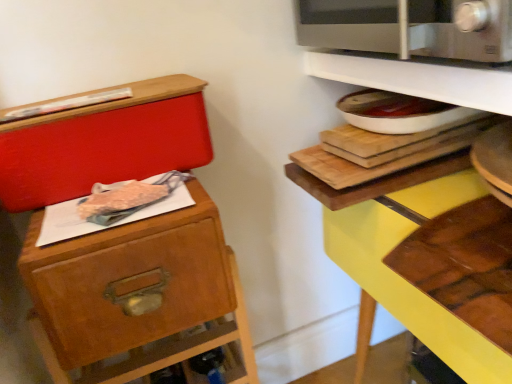
The image size is (512, 384). What are the coordinates of `matte red box at upper left` in the screenshot? It's located at (104, 143).

The height and width of the screenshot is (384, 512). Describe the element at coordinates (133, 292) in the screenshot. I see `wooden drawer at left` at that location.

What is the approximate width of wooden drawer at left?

wooden drawer at left is 7.72 inches wide.

This screenshot has width=512, height=384. What do you see at coordinates (418, 77) in the screenshot?
I see `yellow wood shelf at upper right, which ranks as the 2th shelf in top-to-bottom order` at bounding box center [418, 77].

What do you see at coordinates (461, 29) in the screenshot? This screenshot has height=384, width=512. I see `satin silver microwave at upper right` at bounding box center [461, 29].

Locate an element on the screen. white glossy shelf at upper right, the 2th shelf when ordered from bottom to top is located at coordinates (419, 77).

Considering the sizes of objects matte red box at upper left and wooden drawer at left in the image provided, who is wider, matte red box at upper left or wooden drawer at left?

matte red box at upper left is wider.

Which is less distant, [178,94] or [124,251]?

Point [178,94] is farther from the camera than point [124,251].

From the image's perspective, is matte red box at upper left located beneath wooden drawer at left?

Actually, matte red box at upper left appears above wooden drawer at left in the image.

Is matte red box at upper left bigger or smaller than wooden drawer at left?

matte red box at upper left is bigger than wooden drawer at left.

Is point (480, 54) positioned behind point (382, 185)?

No.

Could you tell me if satin silver microwave at upper right is turned towards yellow wood shelf at upper right, which appears as the 1th shelf when ordered from the bottom?

No, satin silver microwave at upper right is not oriented towards yellow wood shelf at upper right, which appears as the 1th shelf when ordered from the bottom.

What's the angular difference between satin silver microwave at upper right and yellow wood shelf at upper right, which ranks as the 2th shelf in top-to-bottom order,'s facing directions?

There is a 0.464-degree angle between the facing directions of satin silver microwave at upper right and yellow wood shelf at upper right, which ranks as the 2th shelf in top-to-bottom order.

Does satin silver microwave at upper right have a lesser width compared to yellow wood shelf at upper right, which ranks as the 2th shelf in top-to-bottom order?

Yes, satin silver microwave at upper right is thinner than yellow wood shelf at upper right, which ranks as the 2th shelf in top-to-bottom order.

Who is smaller, matte red box at upper left or satin silver microwave at upper right?

With smaller size is matte red box at upper left.

From a real-world perspective, relative to satin silver microwave at upper right, is matte red box at upper left vertically above or below?

Clearly, from a real-world perspective, matte red box at upper left is below satin silver microwave at upper right.

Does point (138, 87) come farther from viewer compared to point (297, 8)?

That is False.

Considering the sizes of objects matte red box at upper left and satin silver microwave at upper right in the image provided, who is taller, matte red box at upper left or satin silver microwave at upper right?

With more height is matte red box at upper left.

From the image's perspective, does wooden drawer at left appear lower than white glossy shelf at upper right, positioned as the first shelf in top-to-bottom order?

Correct, wooden drawer at left appears lower than white glossy shelf at upper right, positioned as the first shelf in top-to-bottom order, in the image.

Find the location of `the 1st shelf in front of the wooden drawer at left`. the 1st shelf in front of the wooden drawer at left is located at coordinates (419, 77).

Looking at this image, can you confirm if wooden drawer at left is wider than white glossy shelf at upper right, positioned as the first shelf in top-to-bottom order?

Incorrect, the width of wooden drawer at left does not surpass that of white glossy shelf at upper right, positioned as the first shelf in top-to-bottom order.

Is wooden drawer at left aimed at white glossy shelf at upper right, the 2th shelf when ordered from bottom to top?

No, wooden drawer at left is not aimed at white glossy shelf at upper right, the 2th shelf when ordered from bottom to top.

Between yellow wood shelf at upper right, which ranks as the 2th shelf in top-to-bottom order, and white glossy shelf at upper right, the 2th shelf when ordered from bottom to top, which one has larger width?

With larger width is yellow wood shelf at upper right, which ranks as the 2th shelf in top-to-bottom order.

Is yellow wood shelf at upper right, which ranks as the 2th shelf in top-to-bottom order, facing towards white glossy shelf at upper right, the 2th shelf when ordered from bottom to top?

No, yellow wood shelf at upper right, which ranks as the 2th shelf in top-to-bottom order, is not facing towards white glossy shelf at upper right, the 2th shelf when ordered from bottom to top.

How many degrees apart are the facing directions of yellow wood shelf at upper right, which ranks as the 2th shelf in top-to-bottom order, and white glossy shelf at upper right, the 2th shelf when ordered from bottom to top?

The angle between the facing direction of yellow wood shelf at upper right, which ranks as the 2th shelf in top-to-bottom order, and the facing direction of white glossy shelf at upper right, the 2th shelf when ordered from bottom to top, is 0.374 degrees.

Which point is more distant from viewer, (403, 320) or (371, 81)?

Point (403, 320)

From the image's perspective, relative to satin silver microwave at upper right, is white glossy shelf at upper right, the 2th shelf when ordered from bottom to top, above or below?

white glossy shelf at upper right, the 2th shelf when ordered from bottom to top, is situated lower than satin silver microwave at upper right in the image.

Can you confirm if white glossy shelf at upper right, positioned as the first shelf in top-to-bottom order, is bigger than satin silver microwave at upper right?

No, white glossy shelf at upper right, positioned as the first shelf in top-to-bottom order, is not bigger than satin silver microwave at upper right.

Who is shorter, white glossy shelf at upper right, positioned as the first shelf in top-to-bottom order, or satin silver microwave at upper right?

white glossy shelf at upper right, positioned as the first shelf in top-to-bottom order, is shorter.

From a real-world perspective, which object rests below the other?

In real-world perspective, white glossy shelf at upper right, positioned as the first shelf in top-to-bottom order, is lower.

Can you confirm if matte red box at upper left is shorter than yellow wood shelf at upper right, which ranks as the 2th shelf in top-to-bottom order?

Yes, matte red box at upper left is shorter than yellow wood shelf at upper right, which ranks as the 2th shelf in top-to-bottom order.

In the image, there is a matte red box at upper left. Where is `shelf below it (from the image's perspective)`? This screenshot has width=512, height=384. shelf below it (from the image's perspective) is located at coordinates (418, 77).

From the picture: Does matte red box at upper left turn towards yellow wood shelf at upper right, which appears as the 1th shelf when ordered from the bottom?

No, matte red box at upper left is not facing towards yellow wood shelf at upper right, which appears as the 1th shelf when ordered from the bottom.

Where is `drawer below the matte red box at upper left (from the image's perspective)`? This screenshot has width=512, height=384. drawer below the matte red box at upper left (from the image's perspective) is located at coordinates (133, 292).

There is a satin silver microwave at upper right. In order to click on the 2nd shelf below it (from a real-world perspective) in this screenshot , I will do `click(418, 77)`.

Estimate the real-world distances between objects in this image. Which object is closer to matte red box at upper left, wooden drawer at left or yellow wood shelf at upper right, which appears as the 1th shelf when ordered from the bottom?

Among the two, wooden drawer at left is located nearer to matte red box at upper left.

Looking at the image, which one is located further to wooden drawer at left, white glossy shelf at upper right, the 2th shelf when ordered from bottom to top, or matte red box at upper left?

The object further to wooden drawer at left is white glossy shelf at upper right, the 2th shelf when ordered from bottom to top.

Which object lies further to the anchor point satin silver microwave at upper right, white glossy shelf at upper right, the 2th shelf when ordered from bottom to top, or yellow wood shelf at upper right, which ranks as the 2th shelf in top-to-bottom order?

yellow wood shelf at upper right, which ranks as the 2th shelf in top-to-bottom order.

Considering their positions, is white glossy shelf at upper right, positioned as the first shelf in top-to-bottom order, positioned further to yellow wood shelf at upper right, which ranks as the 2th shelf in top-to-bottom order, than wooden drawer at left?

wooden drawer at left.

Based on their spatial positions, is satin silver microwave at upper right or matte red box at upper left closer to yellow wood shelf at upper right, which appears as the 1th shelf when ordered from the bottom?

satin silver microwave at upper right.

Consider the image. Which object lies further to the anchor point yellow wood shelf at upper right, which ranks as the 2th shelf in top-to-bottom order, satin silver microwave at upper right or wooden drawer at left?

Based on the image, wooden drawer at left appears to be further to yellow wood shelf at upper right, which ranks as the 2th shelf in top-to-bottom order.

Based on their spatial positions, is wooden drawer at left or matte red box at upper left further from yellow wood shelf at upper right, which appears as the 1th shelf when ordered from the bottom?

wooden drawer at left is further to yellow wood shelf at upper right, which appears as the 1th shelf when ordered from the bottom.

When comparing their distances from yellow wood shelf at upper right, which ranks as the 2th shelf in top-to-bottom order, does wooden drawer at left or white glossy shelf at upper right, the 2th shelf when ordered from bottom to top, seem closer?

Based on the image, white glossy shelf at upper right, the 2th shelf when ordered from bottom to top, appears to be nearer to yellow wood shelf at upper right, which ranks as the 2th shelf in top-to-bottom order.

At what (x,y) coordinates should I click in order to perform the action: click on drawer between matte red box at upper left and yellow wood shelf at upper right, which ranks as the 2th shelf in top-to-bottom order. Please return your answer as a coordinate pair (x, y). The width and height of the screenshot is (512, 384). Looking at the image, I should click on 133,292.

Identify the location of shelf between wooden drawer at left and satin silver microwave at upper right in the horizontal direction. The height and width of the screenshot is (384, 512). (419, 77).

Identify the location of microwave oven located between wooden drawer at left and yellow wood shelf at upper right, which ranks as the 2th shelf in top-to-bottom order, in the left-right direction. (461, 29).

Where is `drawer situated between matte red box at upper left and satin silver microwave at upper right from left to right`? drawer situated between matte red box at upper left and satin silver microwave at upper right from left to right is located at coordinates (133, 292).